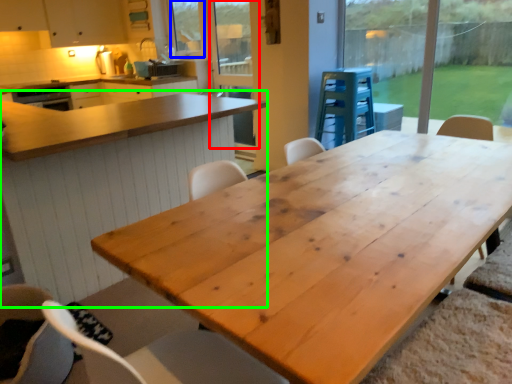
Question: Based on their relative distances, which object is farther from screen door (highlighted by a red box)? Choose from window screen (highlighted by a blue box) and table (highlighted by a green box).

Choices:
 (A) window screen
 (B) table

Answer: (B)